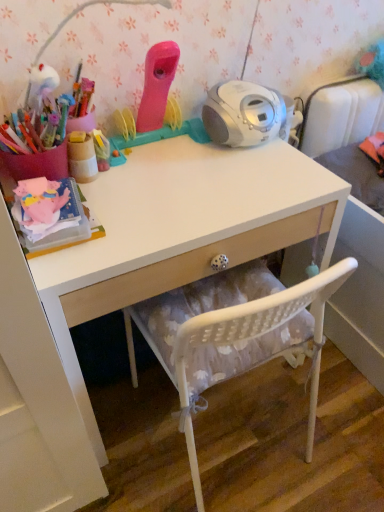
Measure the distance between wooden cup at upper left and camera.

The depth of wooden cup at upper left is 37.99 inches.

This screenshot has height=512, width=384. Find the location of `wooden cup at upper left`. wooden cup at upper left is located at coordinates [81, 157].

Identify the location of white glossy desk at center. Image resolution: width=384 pixels, height=512 pixels. click(x=148, y=292).

Where is `white mesh chair at lower center`? The image size is (384, 512). white mesh chair at lower center is located at coordinates (234, 334).

Find the location of a particular element. This screenshot has width=384, height=512. wooden cup at upper left is located at coordinates click(x=81, y=157).

Is point (149, 304) closer to viewer compared to point (210, 325)?

No, (149, 304) is behind (210, 325).

From a real-world perspective, between white mesh chair at lower center and white glossy desk at center, who is vertically lower?

white mesh chair at lower center, from a real-world perspective.

From the image's perspective, is wooden cup at upper left below white mesh chair at lower center?

Actually, wooden cup at upper left appears above white mesh chair at lower center in the image.

Could you tell me if wooden cup at upper left is facing white mesh chair at lower center?

No, wooden cup at upper left is not oriented towards white mesh chair at lower center.

How distant is wooden cup at upper left from white mesh chair at lower center?

They are 20.73 inches apart.

How many degrees apart are the facing directions of wooden cup at upper left and white mesh chair at lower center?

The angular difference between wooden cup at upper left and white mesh chair at lower center is 88.5 degrees.

Is white glossy desk at center in front of or behind wooden cup at upper left in the image?

Visually, white glossy desk at center is located in front of wooden cup at upper left.

Who is taller, white glossy desk at center or wooden cup at upper left?

white glossy desk at center.

Would you say wooden cup at upper left is part of white glossy desk at center's contents?

Definitely not — wooden cup at upper left is not inside white glossy desk at center.

Considering the positions of points (126, 232) and (73, 161), is point (126, 232) farther from camera compared to point (73, 161)?

No, it is not.

Is white mesh chair at lower center aimed at wooden cup at upper left?

No, white mesh chair at lower center is not facing towards wooden cup at upper left.

From a real-world perspective, which object stands above the other?

wooden cup at upper left is physically above.

Is white mesh chair at lower center positioned far away from wooden cup at upper left?

No, white mesh chair at lower center is not far away from wooden cup at upper left.

From the picture: Does wooden cup at upper left turn towards white glossy desk at center?

No, wooden cup at upper left does not turn towards white glossy desk at center.

Does wooden cup at upper left have a lesser height compared to white glossy desk at center?

Yes, wooden cup at upper left is shorter than white glossy desk at center.

From a real-world perspective, is wooden cup at upper left physically located above or below white glossy desk at center?

Clearly, from a real-world perspective, wooden cup at upper left is above white glossy desk at center.

Considering the sizes of white glossy desk at center and white mesh chair at lower center in the image, is white glossy desk at center bigger or smaller than white mesh chair at lower center?

Clearly, white glossy desk at center is larger in size than white mesh chair at lower center.

Which is more to the left, white glossy desk at center or white mesh chair at lower center?

white glossy desk at center.

From the image's perspective, which is above, white glossy desk at center or white mesh chair at lower center?

white glossy desk at center appears higher in the image.

Is white glossy desk at center next to white mesh chair at lower center and touching it?

No, white glossy desk at center is not next to white mesh chair at lower center.

Find the location of a particular element. The height and width of the screenshot is (512, 384). desk in front of the white mesh chair at lower center is located at coordinates (148, 292).

Identify the location of stationery that is behind the white mesh chair at lower center. (81, 157).

Looking at the image, which one is located further to wooden cup at upper left, white glossy desk at center or white mesh chair at lower center?

white mesh chair at lower center.

Estimate the real-world distances between objects in this image. Which object is further from white glossy desk at center, white mesh chair at lower center or wooden cup at upper left?

wooden cup at upper left is positioned further to the anchor white glossy desk at center.

Considering their positions, is white mesh chair at lower center positioned closer to wooden cup at upper left than white glossy desk at center?

Based on the image, white glossy desk at center appears to be nearer to wooden cup at upper left.

Looking at the image, which one is located closer to white mesh chair at lower center, white glossy desk at center or wooden cup at upper left?

The object closer to white mesh chair at lower center is white glossy desk at center.

When comparing their distances from white mesh chair at lower center, does wooden cup at upper left or white glossy desk at center seem further?

wooden cup at upper left.

From the image, which object appears to be nearer to white glossy desk at center, wooden cup at upper left or white mesh chair at lower center?

Among the two, white mesh chair at lower center is located nearer to white glossy desk at center.

This screenshot has height=512, width=384. I want to click on desk between wooden cup at upper left and white mesh chair at lower center vertically, so click(148, 292).